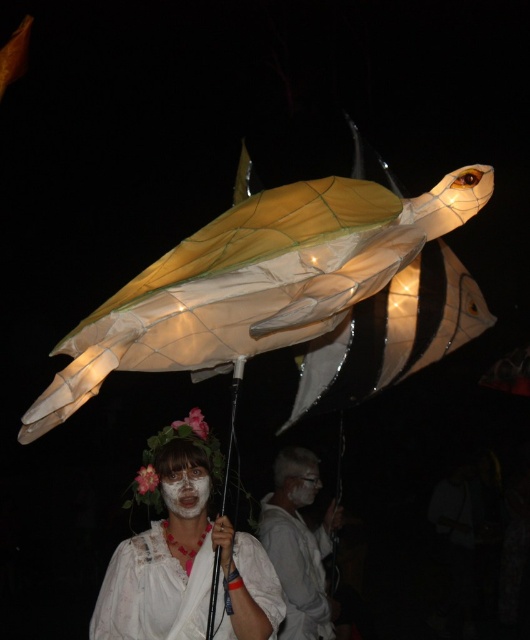
Who is more forward, (135, 616) or (204, 467)?

Positioned in front is point (135, 616).

Is point (243, 573) positioned in front of point (169, 512)?

Yes, it is.

You are a GUI agent. You are given a task and a screenshot of the screen. Output one action in this format:
    pyautogui.click(x=<x>, y=<y>)
    Task: Click on the white lace dress at center
    
    Given the screenshot: What is the action you would take?
    pyautogui.click(x=154, y=589)

Can you confirm if white lace dress at center is taller than matte white face at center?

Indeed, white lace dress at center has a greater height compared to matte white face at center.

Which is above, white lace dress at center or matte white face at center?

matte white face at center is above.

Identify the location of white lace dress at center. The width and height of the screenshot is (530, 640). (154, 589).

You are a GUI agent. You are given a task and a screenshot of the screen. Output one action in this format:
    pyautogui.click(x=<x>, y=<y>)
    Task: Click on the white matte/porcelain mask at center
    
    Given the screenshot: What is the action you would take?
    pyautogui.click(x=298, y=545)

Is point (280, 456) positioned before point (295, 481)?

That is False.

Is point (320, 586) less distant than point (306, 486)?

Yes.

Find the location of a particular element. The height and width of the screenshot is (640, 530). white matte/porcelain mask at center is located at coordinates (298, 545).